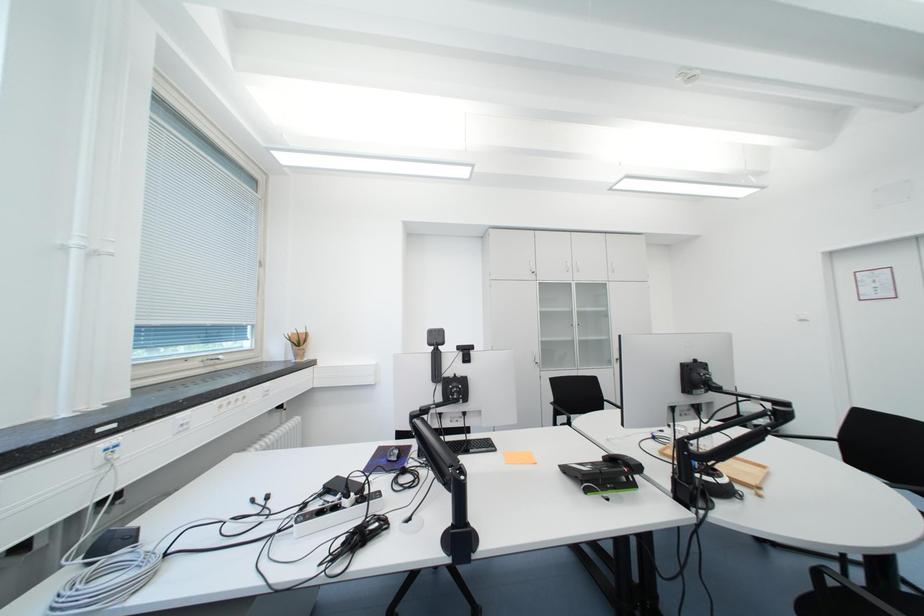
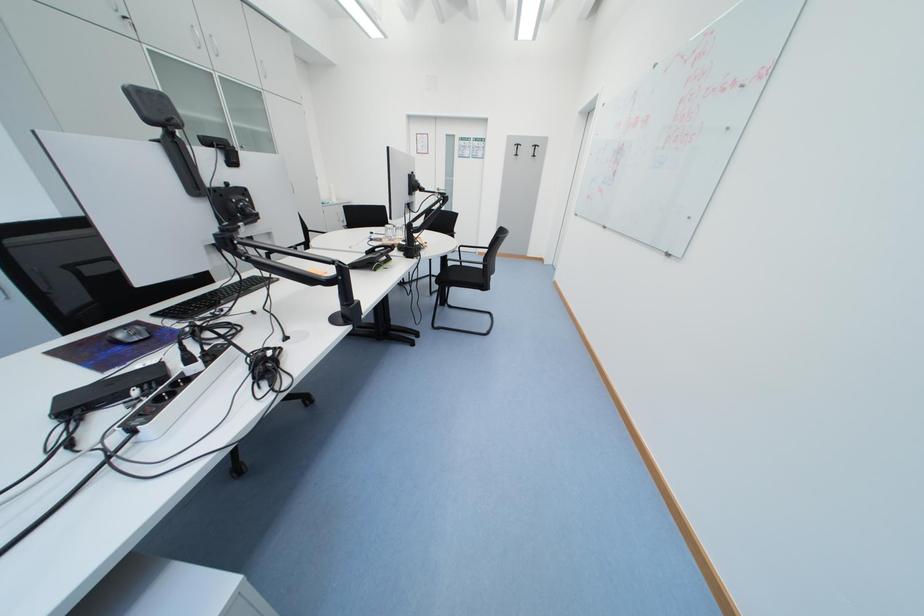
How did the camera likely rotate?

The rotation direction of the camera is right-down.